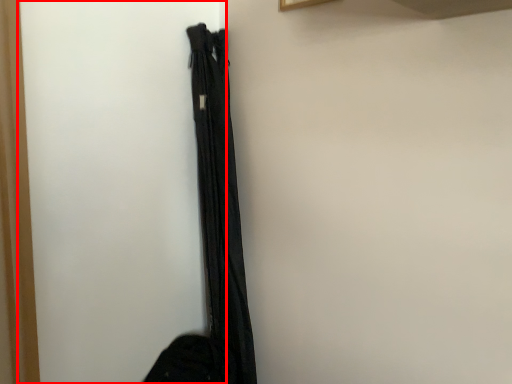
Question: From the image's perspective, what is the correct spatial relationship of screen door (annotated by the red box) in relation to curtain?

Choices:
 (A) above
 (B) below

Answer: (A)